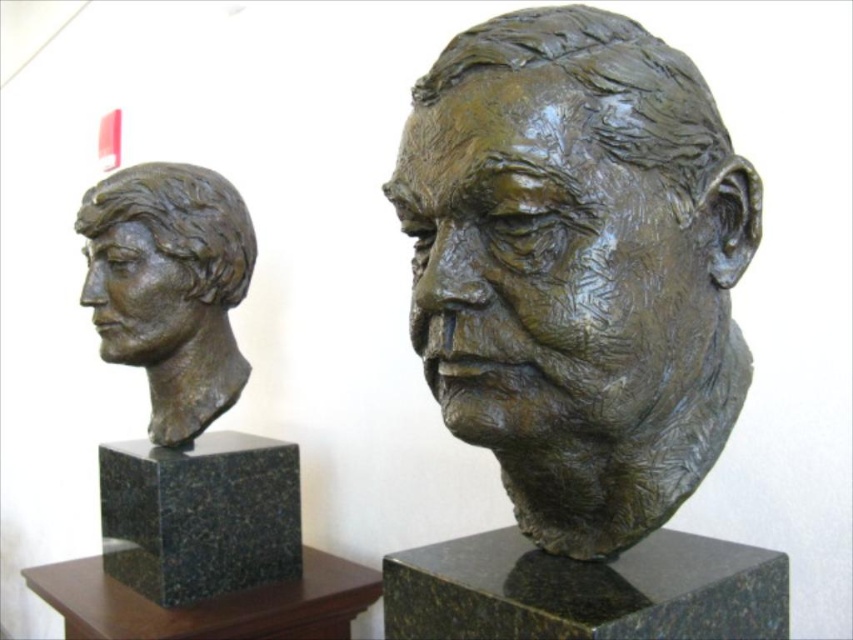
Consider the image. You are standing in front of two bronze busts displayed side by side. There is a point at coordinates point [154,208]. Can you estimate how far this point is from you in feet?

The point [154,208] is 6.10 feet away from the viewer.

You are an art curator examining the two bronze busts displayed against a plain white wall. You notice a point marked at coordinates (x=577, y=268). Based on the description, which bronze sculpture does this point correspond to?

The point at coordinates (x=577, y=268) corresponds to the bronze sculpture at center, which is one of the two displayed busts.

You are an art curator arranging an exhibition. You have two bronze pieces in front of you, the bronze sculpture at center and the bronze bust at left. According to their positions in the image, which one should you place on the right side of the exhibition layout to maintain consistency with the original display?

The bronze sculpture at center should be placed on the right side of the exhibition layout because it was originally positioned to the right of the bronze bust at left in the image.